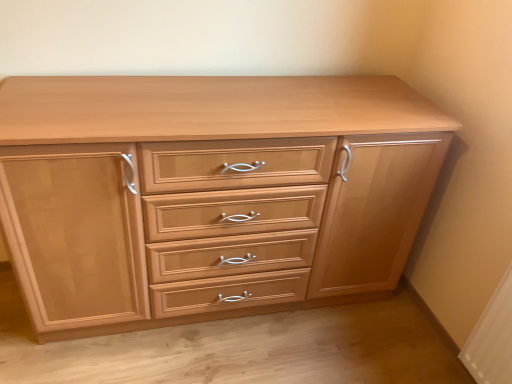
Measure the distance between point [150,214] and camera.

Point [150,214] is 4.30 feet away from camera.

Where is `light wood chest of drawers at center`? The width and height of the screenshot is (512, 384). light wood chest of drawers at center is located at coordinates (209, 193).

The width and height of the screenshot is (512, 384). Describe the element at coordinates (209, 193) in the screenshot. I see `light wood chest of drawers at center` at that location.

At what (x,y) coordinates should I click in order to perform the action: click on light wood chest of drawers at center. Please return your answer as a coordinate pair (x, y). Image resolution: width=512 pixels, height=384 pixels. Looking at the image, I should click on pyautogui.click(x=209, y=193).